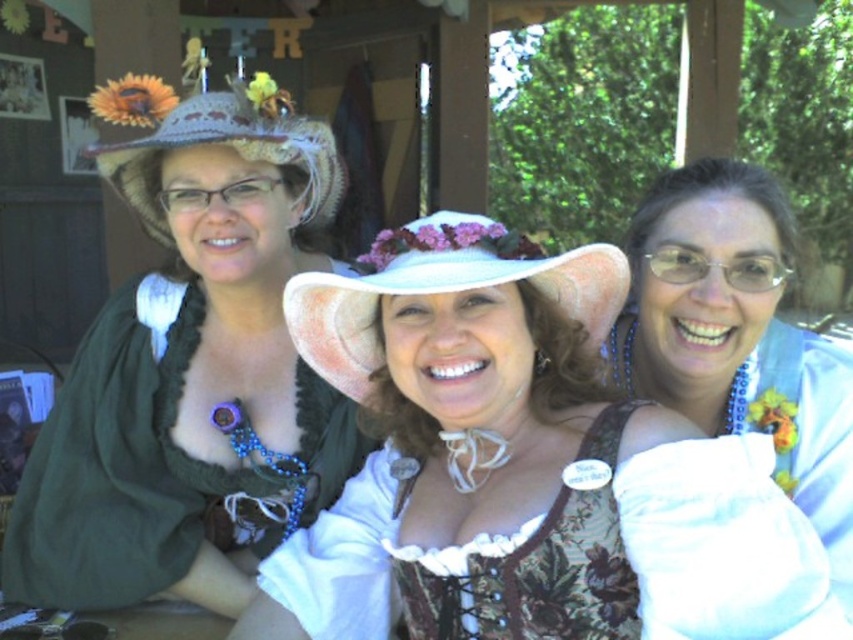
Which of these two, matte green dress at upper left or crochethat at left, stands shorter?

Standing shorter between the two is crochethat at left.

Does point (91, 428) come farther from viewer compared to point (144, 124)?

That is True.

Where is `matte green dress at upper left`? The image size is (853, 640). matte green dress at upper left is located at coordinates (190, 368).

Is white fabric dress at center thinner than crochethat at left?

No, white fabric dress at center is not thinner than crochethat at left.

Does point (642, 524) come closer to viewer compared to point (318, 186)?

Yes.

Find the location of a particular element. white fabric dress at center is located at coordinates (523, 467).

Does white satin dress at center come behind white fabric hat at center?

No, white satin dress at center is in front of white fabric hat at center.

Is point (827, 429) farther from viewer compared to point (432, 216)?

Yes, it is.

Locate an element on the screen. white satin dress at center is located at coordinates (740, 346).